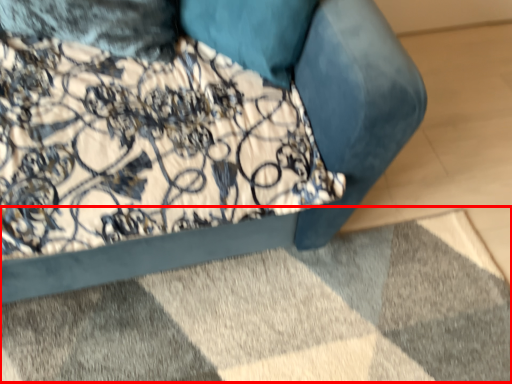
Question: From the image's perspective, where is mat (annotated by the red box) located relative to furniture?

Choices:
 (A) below
 (B) above

Answer: (A)